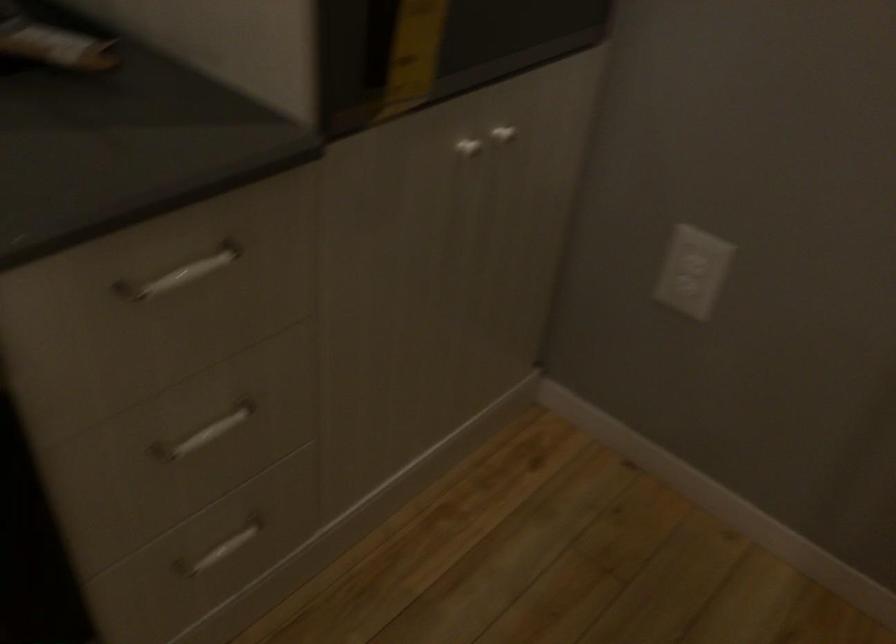
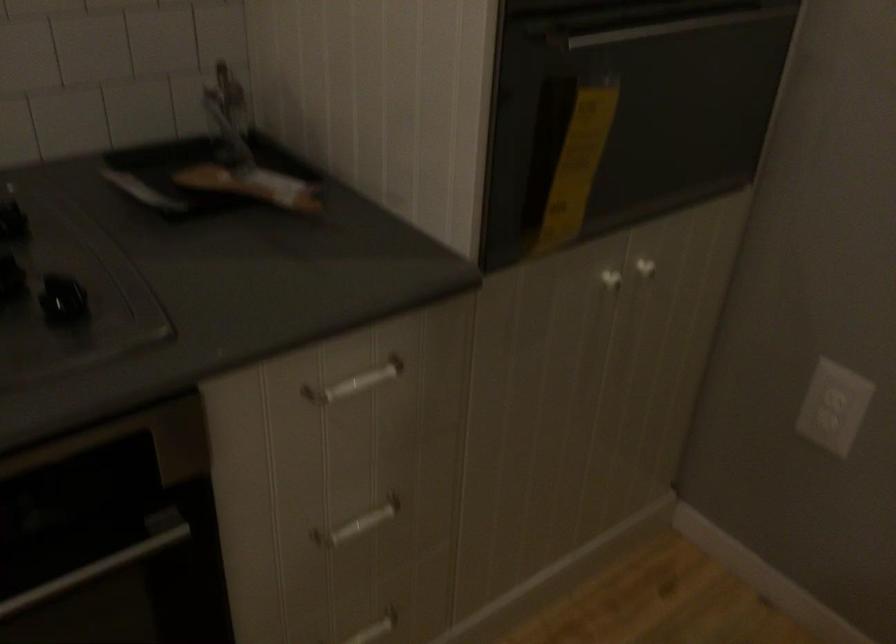
Locate, in the second image, the point that corresponds to point (238, 541) in the first image.

(374, 629)